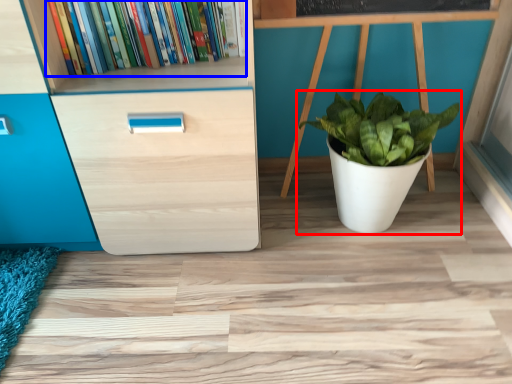
Question: Which point is closer to the camera, houseplant (highlighted by a red box) or book (highlighted by a blue box)?

Choices:
 (A) houseplant
 (B) book

Answer: (B)